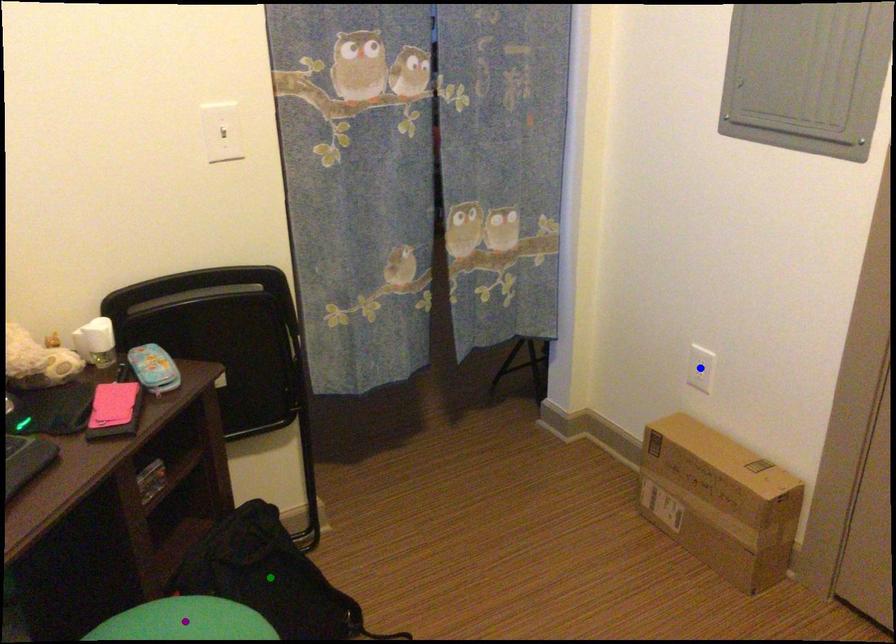
Order these from nearest to farthest:
1. green point
2. blue point
3. purple point

purple point → green point → blue point